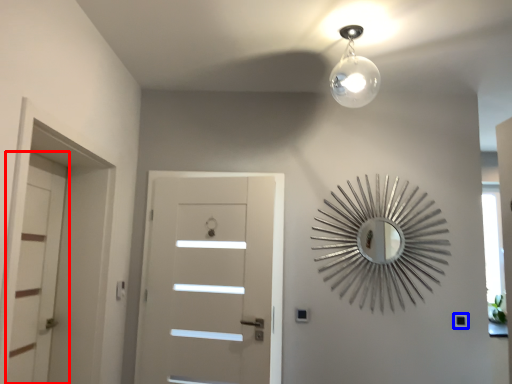
Question: Which point is closer to the camera, door (highlighted by a red box) or light switch (highlighted by a blue box)?

Choices:
 (A) door
 (B) light switch

Answer: (A)